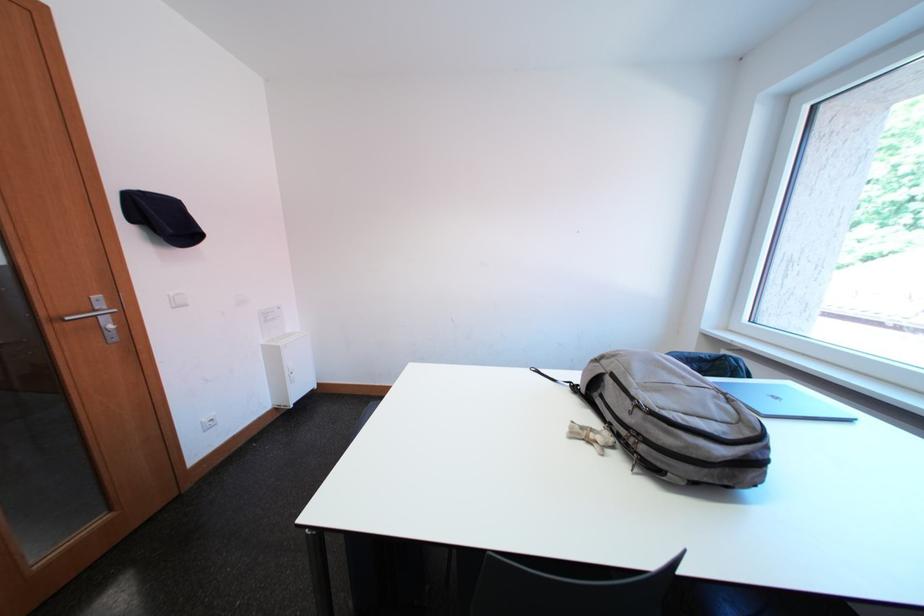
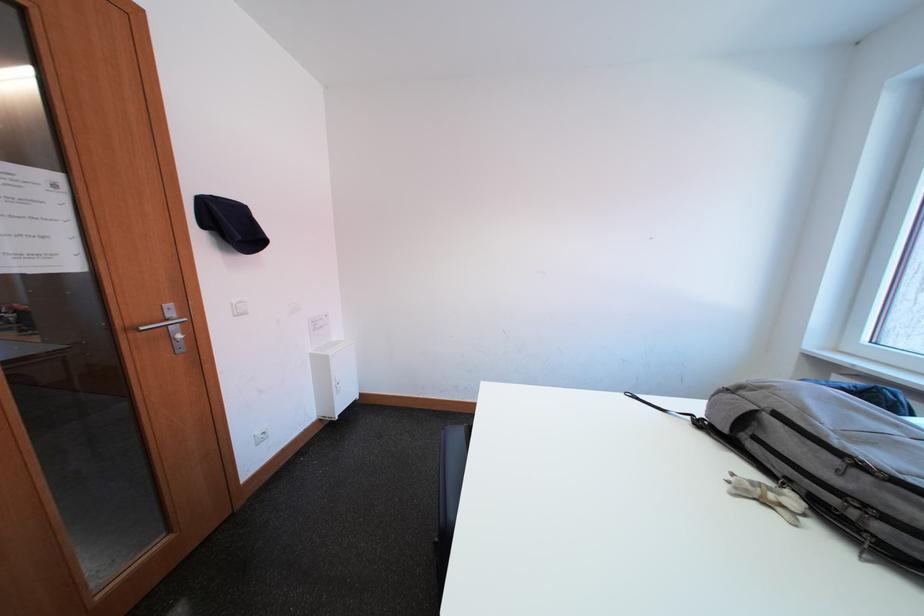
Locate, in the second image, the point that corresponds to (110,309) in the first image.

(180, 317)